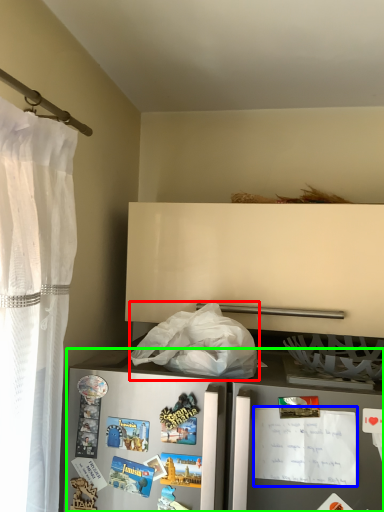
Question: Considering the real-world distances, which object is closest to plastic bag (highlighted by a red box)? postcard (highlighted by a blue box) or refrigerator (highlighted by a green box).

Choices:
 (A) postcard
 (B) refrigerator

Answer: (B)